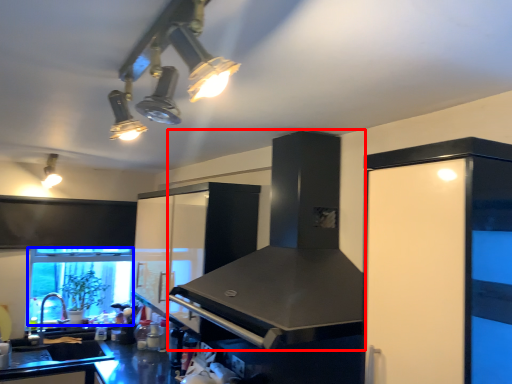
Question: Which point is further to the camera, vent (highlighted by a red box) or window screen (highlighted by a blue box)?

Choices:
 (A) vent
 (B) window screen

Answer: (B)